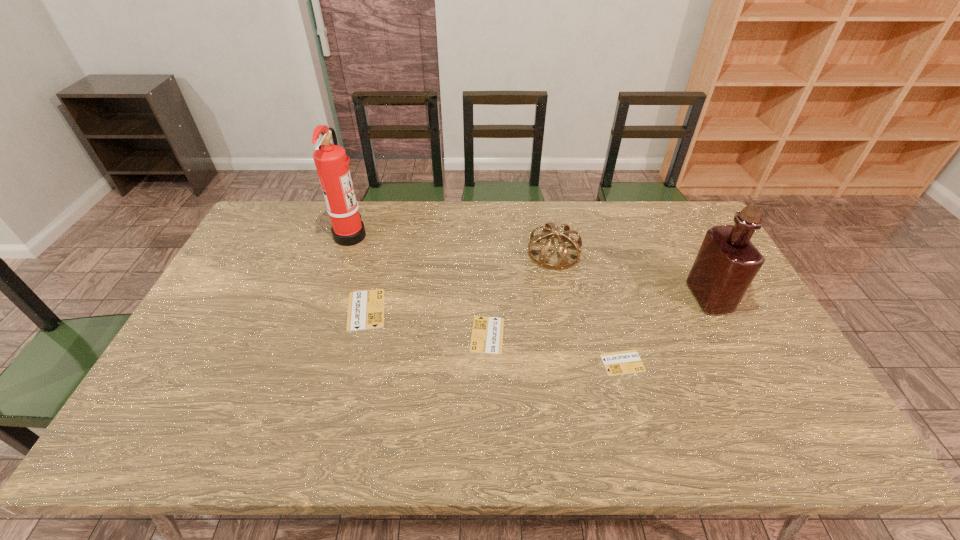
I want to click on the leftmost identity card, so point(366,308).

At what (x,y) coordinates should I click in order to perform the action: click on the fifth object from right to left. Please return your answer as a coordinate pair (x, y). The width and height of the screenshot is (960, 540). Looking at the image, I should click on (366, 308).

Identify the location of the second shortest object. Image resolution: width=960 pixels, height=540 pixels. (487, 334).

Where is `the second shortest identity card`? Image resolution: width=960 pixels, height=540 pixels. the second shortest identity card is located at coordinates (487, 334).

Locate an element on the screen. The height and width of the screenshot is (540, 960). the rightmost identity card is located at coordinates (624, 362).

Locate an element on the screen. The image size is (960, 540). the shortest object is located at coordinates (624, 362).

This screenshot has height=540, width=960. Identify the location of the leftmost object. coord(331,163).

Locate an element on the screen. This screenshot has height=540, width=960. fire extinguisher is located at coordinates (331, 163).

Where is `the third tallest object`? The image size is (960, 540). the third tallest object is located at coordinates (563, 264).

You are a GUI agent. You are given a task and a screenshot of the screen. Output one action in this format:
    pyautogui.click(x=<x>, y=<y>)
    Task: Click on the fifth shortest object
    This screenshot has width=960, height=540.
    Given the screenshot: What is the action you would take?
    pyautogui.click(x=727, y=262)